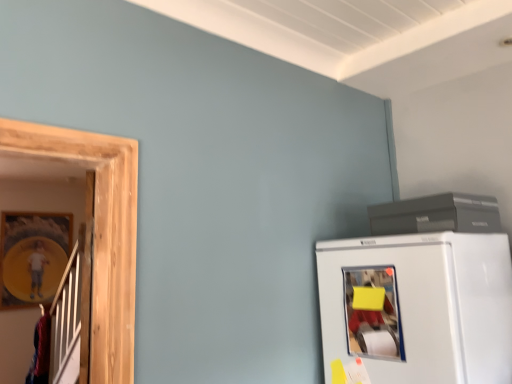
What do you see at coordinates (436, 215) in the screenshot? The image size is (512, 384). I see `matte gray printer at upper right` at bounding box center [436, 215].

This screenshot has width=512, height=384. I want to click on wooden framed picture at left, so click(32, 256).

From a real-world perspective, is matte gray printer at upper right above or below yellow matte paper at lower right?

matte gray printer at upper right is above yellow matte paper at lower right.

From the image's perspective, which one is positioned higher, matte gray printer at upper right or yellow matte paper at lower right?

matte gray printer at upper right is shown above in the image.

How many degrees apart are the facing directions of matte gray printer at upper right and yellow matte paper at lower right?

They differ by 8.76 degrees in their facing directions.

Considering the sizes of objects matte gray printer at upper right and yellow matte paper at lower right in the image provided, who is taller, matte gray printer at upper right or yellow matte paper at lower right?

With more height is yellow matte paper at lower right.

Consider the image. Can you confirm if wooden framed picture at left is positioned to the right of yellow matte paper at lower right?

In fact, wooden framed picture at left is to the left of yellow matte paper at lower right.

Is the depth of wooden framed picture at left greater than that of yellow matte paper at lower right?

Yes, wooden framed picture at left is further from the viewer.

Who is bigger, wooden framed picture at left or yellow matte paper at lower right?

wooden framed picture at left.

Is wooden framed picture at left taller or shorter than yellow matte paper at lower right?

Considering their sizes, wooden framed picture at left has more height than yellow matte paper at lower right.

Between yellow matte paper at lower right and matte gray printer at upper right, which one has larger size?

With larger size is matte gray printer at upper right.

Does point (379, 324) appear closer or farther from the camera than point (372, 217)?

Point (379, 324) is closer to the camera than point (372, 217).

Is yellow matte paper at lower right next to matte gray printer at upper right?

No, yellow matte paper at lower right is not touching matte gray printer at upper right.

What's the angular difference between white matte refrigerator at lower right and wooden framed picture at left's facing directions?

There is a 89.2-degree angle between the facing directions of white matte refrigerator at lower right and wooden framed picture at left.

Are white matte refrigerator at lower right and wooden framed picture at left located far from each other?

Yes, white matte refrigerator at lower right is far from wooden framed picture at left.

Looking at their sizes, would you say white matte refrigerator at lower right is wider or thinner than wooden framed picture at left?

In the image, white matte refrigerator at lower right appears to be wider than wooden framed picture at left.

From the image's perspective, is white matte refrigerator at lower right above or below wooden framed picture at left?

Based on their image positions, white matte refrigerator at lower right is located above wooden framed picture at left.

Looking at this image, considering the relative positions of yellow matte paper at lower right and white matte refrigerator at lower right in the image provided, is yellow matte paper at lower right to the left of white matte refrigerator at lower right from the viewer's perspective?

Indeed, yellow matte paper at lower right is positioned on the left side of white matte refrigerator at lower right.

From the image's perspective, does yellow matte paper at lower right appear lower than white matte refrigerator at lower right?

No.

Who is taller, yellow matte paper at lower right or white matte refrigerator at lower right?

white matte refrigerator at lower right is taller.

Considering the points (398, 331) and (400, 243), which point is behind, point (398, 331) or point (400, 243)?

The point (400, 243) is farther.

Considering the sizes of matte gray printer at upper right and wooden framed picture at left in the image, is matte gray printer at upper right taller or shorter than wooden framed picture at left?

Considering their sizes, matte gray printer at upper right has less height than wooden framed picture at left.

In the scene shown: Can you see matte gray printer at upper right touching wooden framed picture at left?

No, matte gray printer at upper right is not beside wooden framed picture at left.

Considering the relative positions of matte gray printer at upper right and wooden framed picture at left in the image provided, is matte gray printer at upper right to the left or to the right of wooden framed picture at left?

matte gray printer at upper right is to the right of wooden framed picture at left.

From their relative heights in the image, would you say wooden framed picture at left is taller or shorter than matte gray printer at upper right?

Considering their sizes, wooden framed picture at left has more height than matte gray printer at upper right.

From the image's perspective, which is below, wooden framed picture at left or matte gray printer at upper right?

From the image's view, wooden framed picture at left is below.

I want to click on appliance above the wooden framed picture at left (from the image's perspective), so click(436, 215).

In the image, is wooden framed picture at left positioned in front of or behind matte gray printer at upper right?

In the image, wooden framed picture at left appears behind matte gray printer at upper right.

Identify the location of appliance on the right of yellow matte paper at lower right. This screenshot has width=512, height=384. (436, 215).

In the image, there is a yellow matte paper at lower right. Where is `picture frame below it (from the image's perspective)`? picture frame below it (from the image's perspective) is located at coordinates (32, 256).

Looking at the image, which one is located closer to wooden framed picture at left, yellow matte paper at lower right or white matte refrigerator at lower right?

white matte refrigerator at lower right.

From the image, which object appears to be farther from wooden framed picture at left, yellow matte paper at lower right or matte gray printer at upper right?

matte gray printer at upper right.

Looking at the image, which one is located closer to white matte refrigerator at lower right, matte gray printer at upper right or yellow matte paper at lower right?

Among the two, yellow matte paper at lower right is located nearer to white matte refrigerator at lower right.

Which object lies nearer to the anchor point yellow matte paper at lower right, wooden framed picture at left or white matte refrigerator at lower right?

Among the two, white matte refrigerator at lower right is located nearer to yellow matte paper at lower right.

Estimate the real-world distances between objects in this image. Which object is closer to wooden framed picture at left, white matte refrigerator at lower right or yellow matte paper at lower right?

Among the two, white matte refrigerator at lower right is located nearer to wooden framed picture at left.

Looking at the image, which one is located closer to wooden framed picture at left, matte gray printer at upper right or yellow matte paper at lower right?

yellow matte paper at lower right.

Estimate the real-world distances between objects in this image. Which object is closer to yellow matte paper at lower right, matte gray printer at upper right or wooden framed picture at left?

matte gray printer at upper right is closer to yellow matte paper at lower right.

When comparing their distances from wooden framed picture at left, does matte gray printer at upper right or white matte refrigerator at lower right seem closer?

Among the two, white matte refrigerator at lower right is located nearer to wooden framed picture at left.

Find the location of `appliance positioned between yellow matte paper at lower right and wooden framed picture at left from near to far`. appliance positioned between yellow matte paper at lower right and wooden framed picture at left from near to far is located at coordinates (436, 215).

The image size is (512, 384). In order to click on window between white matte refrigerator at lower right and wooden framed picture at left in the front-back direction in this screenshot , I will do `click(373, 313)`.

Locate an element on the screen. This screenshot has height=384, width=512. window that lies between matte gray printer at upper right and white matte refrigerator at lower right from top to bottom is located at coordinates (373, 313).

Where is `refrigerator situated between wooden framed picture at left and matte gray printer at upper right from left to right`? Image resolution: width=512 pixels, height=384 pixels. refrigerator situated between wooden framed picture at left and matte gray printer at upper right from left to right is located at coordinates point(416,308).